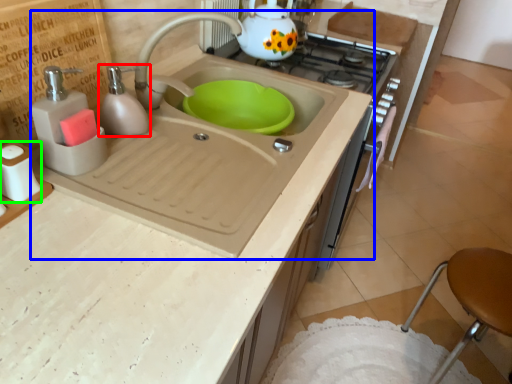
Question: Based on their relative distances, which object is farther from soap dispenser (highlighted by a red box)? Choose from sink (highlighted by a blue box) and salt shaker (highlighted by a green box).

Choices:
 (A) sink
 (B) salt shaker

Answer: (B)